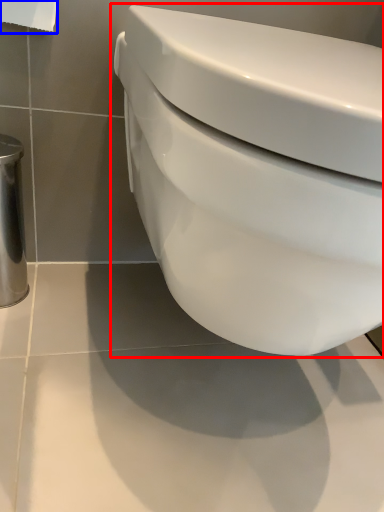
Question: Which point is closer to the camera, toilet (highlighted by a red box) or toilet paper (highlighted by a blue box)?

Choices:
 (A) toilet
 (B) toilet paper

Answer: (A)